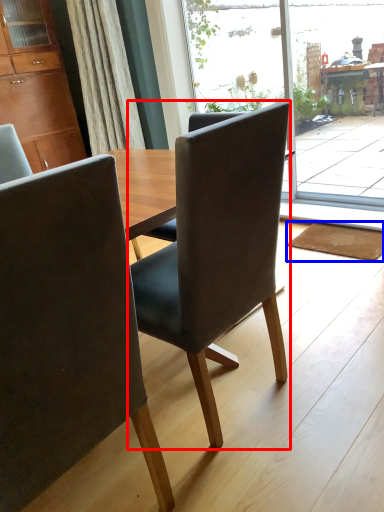
Question: Which object is closer to the camera taking this photo, chair (highlighted by a red box) or mat (highlighted by a blue box)?

Choices:
 (A) chair
 (B) mat

Answer: (A)